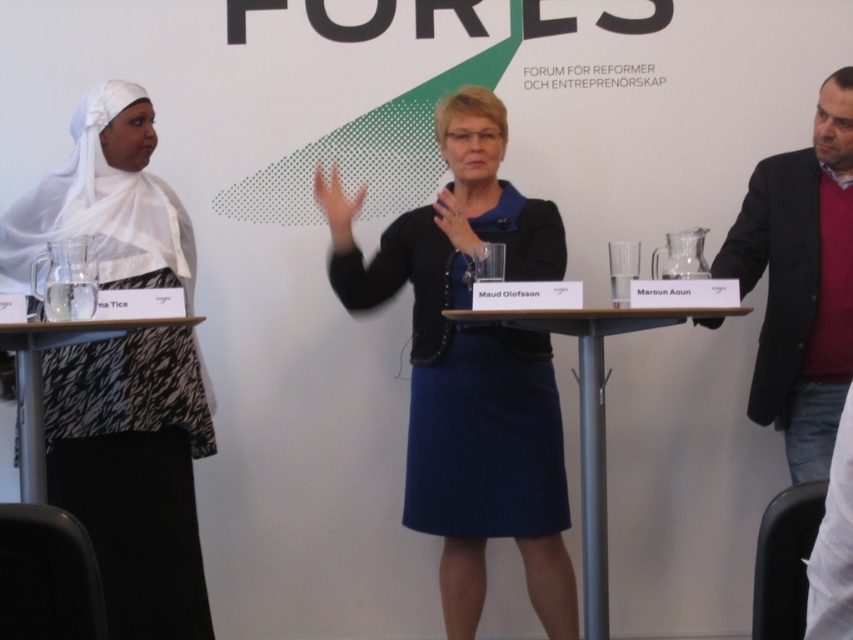
Does wooden table at center have a greater width compared to zebra-patterned fabric at left?

Yes.

Is wooden table at center positioned before zebra-patterned fabric at left?

No, it is behind zebra-patterned fabric at left.

The height and width of the screenshot is (640, 853). What do you see at coordinates (590, 413) in the screenshot?
I see `wooden table at center` at bounding box center [590, 413].

At what (x,y) coordinates should I click in order to perform the action: click on wooden table at center. Please return your answer as a coordinate pair (x, y). Image resolution: width=853 pixels, height=640 pixels. Looking at the image, I should click on (590, 413).

Based on the photo, between blue fabric skirt at center and white silk hijab at left, which one is positioned lower?

blue fabric skirt at center is below.

Does blue fabric skirt at center have a lesser height compared to white silk hijab at left?

In fact, blue fabric skirt at center may be taller than white silk hijab at left.

Describe the element at coordinates (473, 369) in the screenshot. The width and height of the screenshot is (853, 640). I see `blue fabric skirt at center` at that location.

I want to click on blue fabric skirt at center, so click(x=473, y=369).

From the picture: Can you confirm if dark gray blazer at right is bigger than zebra-patterned fabric at left?

Yes.

Between dark gray blazer at right and zebra-patterned fabric at left, which one is positioned higher?

Positioned higher is dark gray blazer at right.

The image size is (853, 640). I want to click on dark gray blazer at right, so click(801, 282).